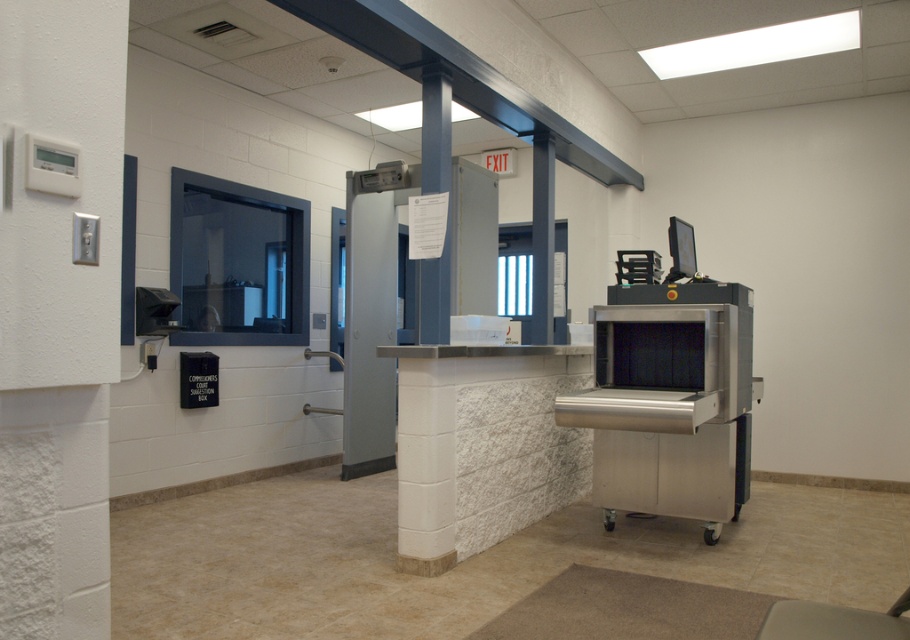
You are standing at the security checkpoint area. There is a point marked at coordinates (58, 316). What is the object located at this point?

The point at coordinates (58, 316) marks the white textured wall at left.

You are a delivery person who just arrived at the security checkpoint. You need to place a new oven in the exact center of the room. Is the current stainless steel oven at center already placed correctly?

The stainless steel oven at center is already placed correctly because its position is at point (666,358), which is the exact center of the room.

You are a security guard at the checkpoint and need to access both the stainless steel oven at center and the gray metallic door at center. Which one do you need to walk towards first to reach first?

You should walk towards the stainless steel oven at center first since it is closer to you than the gray metallic door at center.